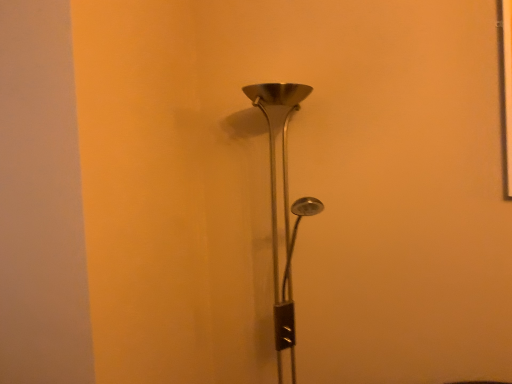
Describe the element at coordinates (283, 204) in the screenshot. I see `metallic silver lamp at center` at that location.

Locate an element on the screen. metallic silver lamp at center is located at coordinates (283, 204).

The image size is (512, 384). What are the coordinates of `metallic silver lamp at center` in the screenshot? It's located at (283, 204).